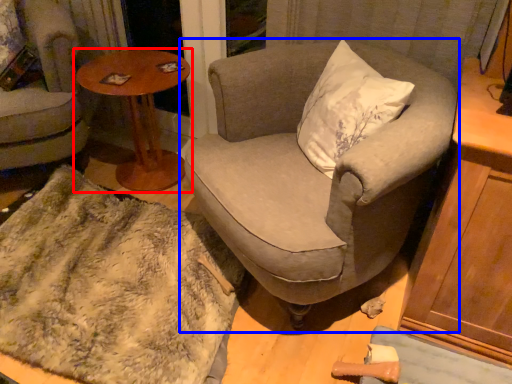
Question: Which of the following is the closest to the observer, table (highlighted by a red box) or chair (highlighted by a blue box)?

Choices:
 (A) table
 (B) chair

Answer: (B)